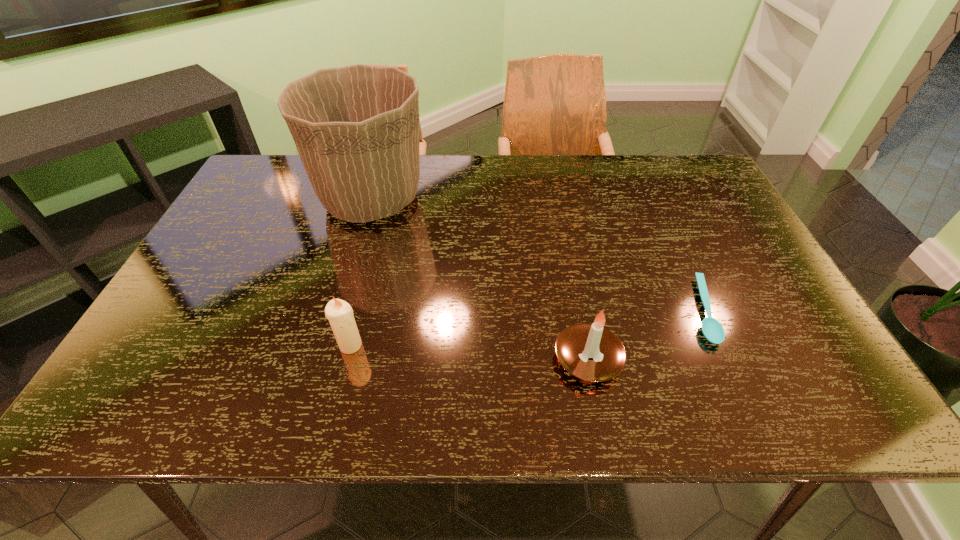
I want to click on object that is at the far edge, so click(357, 129).

At what (x,y) coordinates should I click in order to perform the action: click on object at the near edge. Please return your answer as a coordinate pair (x, y). Image resolution: width=960 pixels, height=540 pixels. Looking at the image, I should click on (591, 352).

In the image, there is a desktop. Where is `free space at the far edge`? free space at the far edge is located at coordinates (630, 189).

You are a GUI agent. You are given a task and a screenshot of the screen. Output one action in this format:
    pyautogui.click(x=<x>, y=<y>)
    Task: Click on the free region at the near edge of the desktop
    This screenshot has width=960, height=540.
    Given the screenshot: What is the action you would take?
    pyautogui.click(x=574, y=404)

Where is `free region at the left edge of the desktop`? The height and width of the screenshot is (540, 960). free region at the left edge of the desktop is located at coordinates (190, 355).

This screenshot has width=960, height=540. In the image, there is a desktop. Identify the location of vacant space at the right edge. (709, 210).

Where is `vacant space at the near right corner of the desktop`? This screenshot has width=960, height=540. vacant space at the near right corner of the desktop is located at coordinates (828, 411).

Locate an element on the screen. The width and height of the screenshot is (960, 540). free space between the farthest object and the second object from right to left is located at coordinates (480, 279).

At what (x,y) coordinates should I click in order to perform the action: click on empty space that is in between the left candle and the third object from left to right. Please return your answer as a coordinate pair (x, y). Image resolution: width=960 pixels, height=540 pixels. Looking at the image, I should click on (469, 352).

Image resolution: width=960 pixels, height=540 pixels. Identify the location of vacant space that is in between the right candle and the left candle. (469, 352).